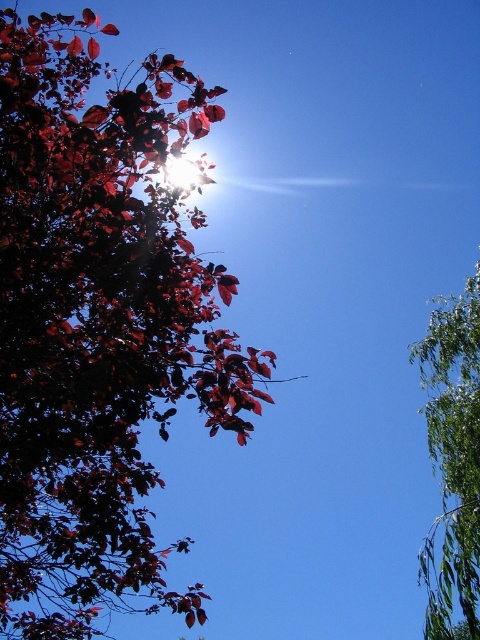
Question: Is shiny red leaves at upper left to the left of green leafy branch at right from the viewer's perspective?

Choices:
 (A) yes
 (B) no

Answer: (A)

Question: Among these points, which one is nearest to the camera?

Choices:
 (A) (479, 554)
 (B) (35, 324)

Answer: (B)

Question: Where is shiny red leaves at upper left located in relation to green leafy branch at right in the image?

Choices:
 (A) left
 (B) right

Answer: (A)

Question: Is shiny red leaves at upper left to the right of green leafy branch at right from the viewer's perspective?

Choices:
 (A) yes
 (B) no

Answer: (B)